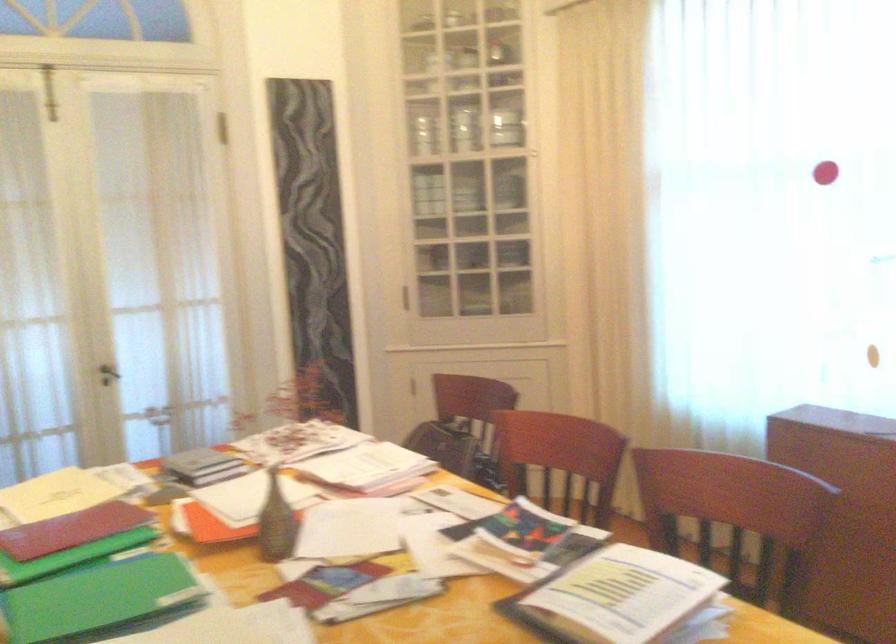
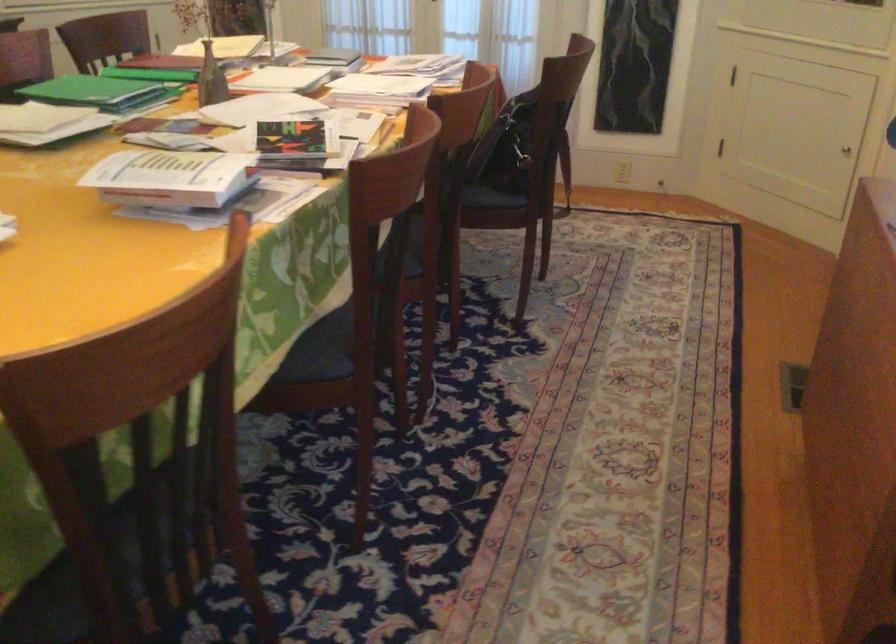
Find the pixel in the second image that matches [280,525] in the first image.

(211, 79)